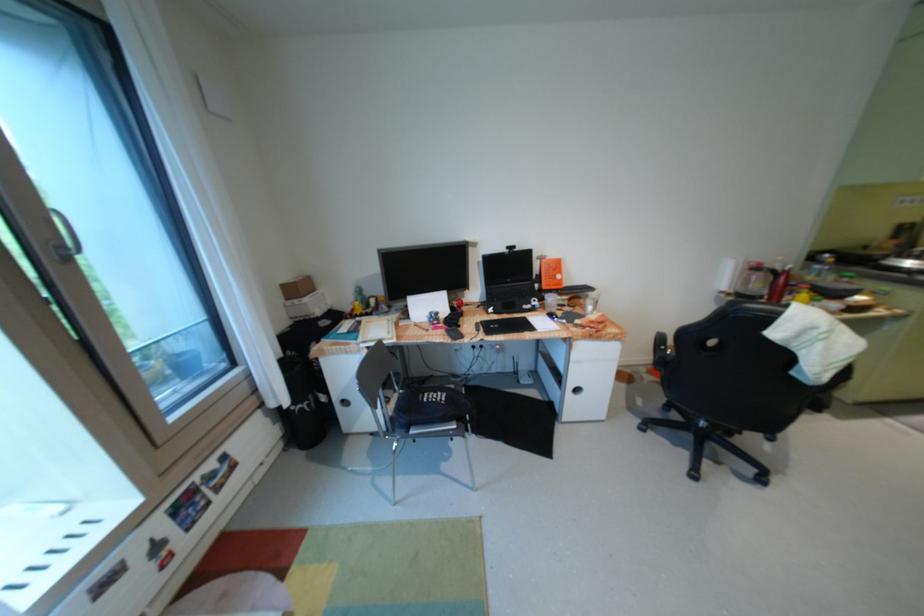
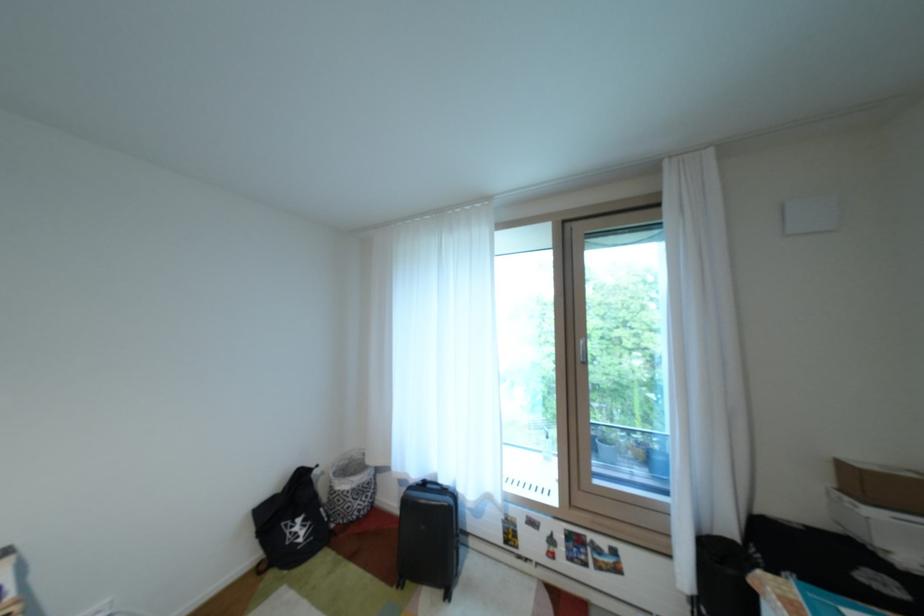
Question: The camera is either moving clockwise (left) or counter-clockwise (right) around the object. The first image is from the beginning of the video and the second image is from the end. Is the camera moving left or right when shooting the video?

Choices:
 (A) Left
 (B) Right

Answer: (B)